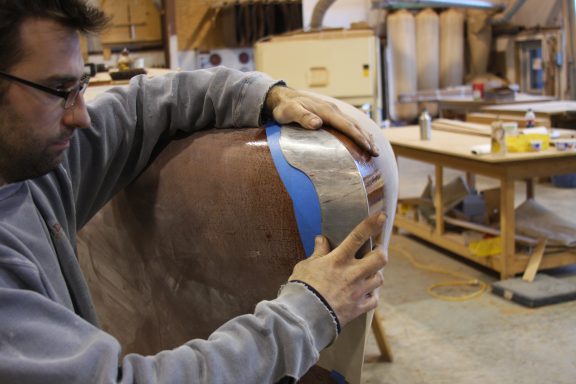
Locate an element on the screen. paint is located at coordinates (426, 123), (497, 136), (529, 114).